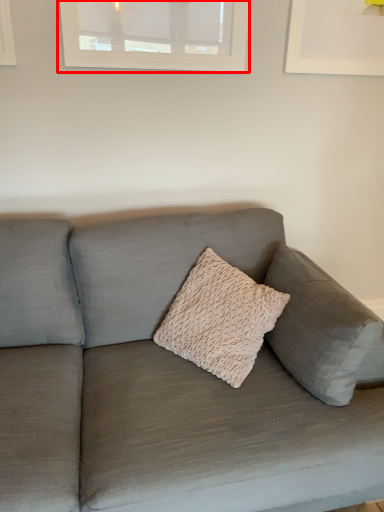
Question: Considering the relative positions of window (annotated by the red box) and studio couch in the image provided, where is window (annotated by the red box) located with respect to the staircase?

Choices:
 (A) right
 (B) left

Answer: (B)